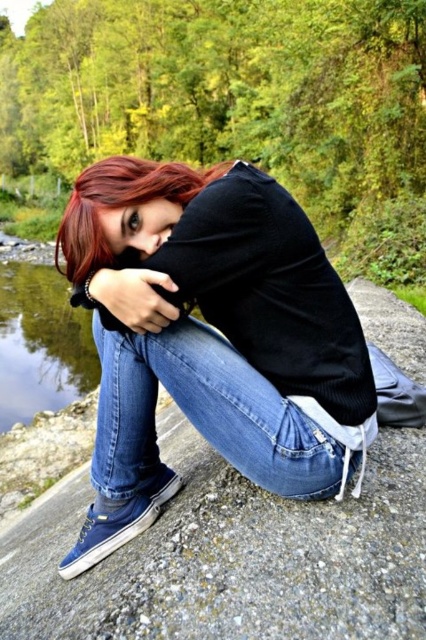
Question: Considering the relative positions of blue denim jeans at center and matte black hand at center in the image provided, where is blue denim jeans at center located with respect to matte black hand at center?

Choices:
 (A) right
 (B) left

Answer: (A)

Question: Observing the image, what is the correct spatial positioning of denim jeans at lower center in reference to matte black hand at center?

Choices:
 (A) left
 (B) right

Answer: (B)

Question: Estimate the real-world distances between objects in this image. Which object is farther from the clear water at lower left?

Choices:
 (A) denim jeans at lower center
 (B) blue denim jeans at center

Answer: (A)

Question: Estimate the real-world distances between objects in this image. Which object is farther from the denim jeans at lower center?

Choices:
 (A) clear water at lower left
 (B) matte black hand at center

Answer: (A)

Question: Which is nearer to the matte black hand at center?

Choices:
 (A) clear water at lower left
 (B) blue denim jeans at center
 (C) denim jeans at lower center

Answer: (C)

Question: Where is blue denim jeans at center located in relation to denim jeans at lower center in the image?

Choices:
 (A) above
 (B) below

Answer: (A)